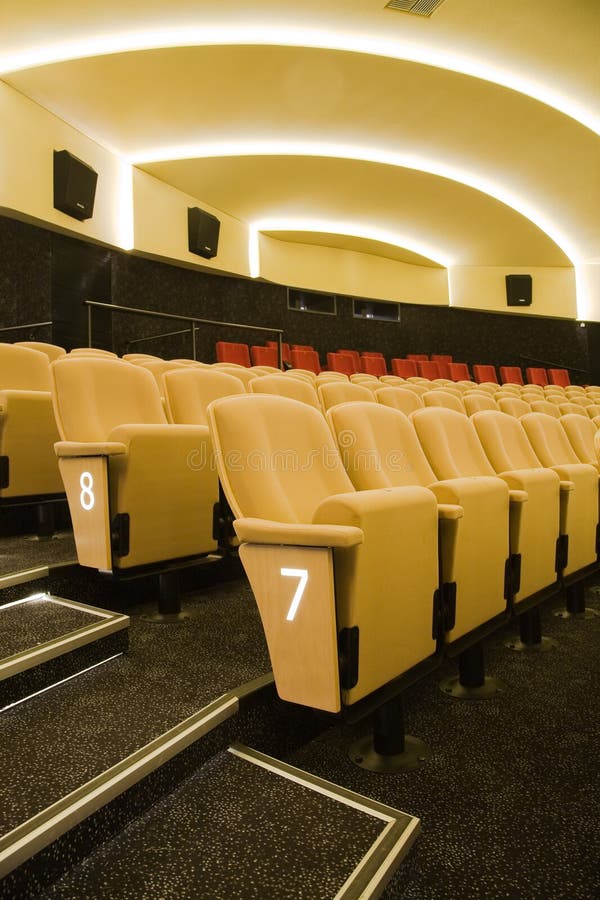
Provide coordinates for each where movie seat is bolted to the floor instance in the image. Your answer should be formatted as a list of tuples, i.e. [(x1, y1), (x2, y2), ...], where each tuple contains the x and y coordinates of a point satisfying the conditions above.

[(578, 603), (533, 627), (474, 668), (393, 729), (170, 595), (42, 516)]